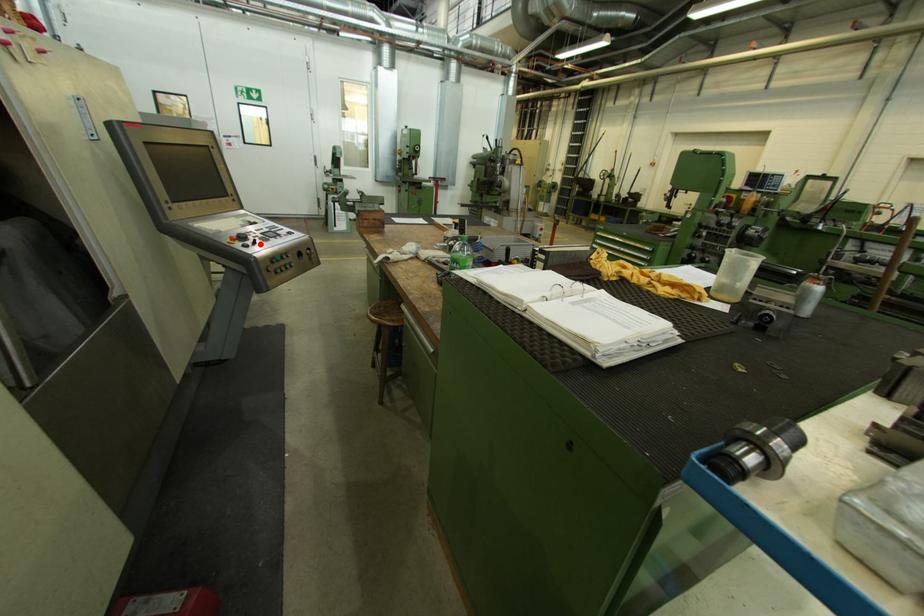
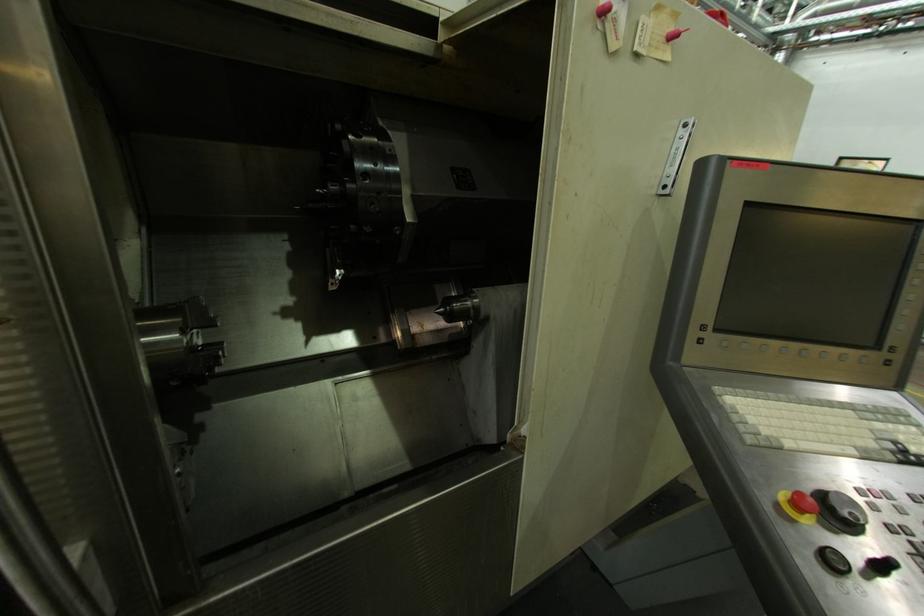
Locate, in the second image, the point that corresponds to the highlighted location in the first image.

(888, 569)